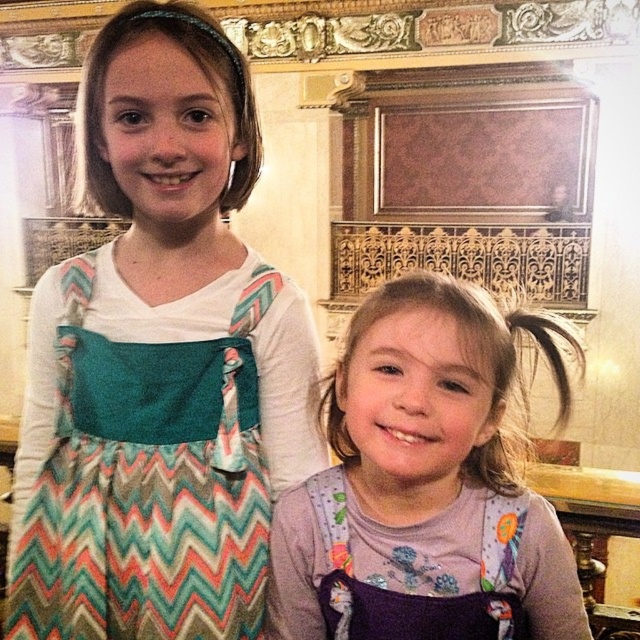
Question: Among these objects, which one is farthest from the camera?

Choices:
 (A) purple fabric overalls at center
 (B) chevron-patterned fabric apron at left

Answer: (B)

Question: Can you confirm if purple fabric overalls at center is bigger than chevron-patterned fabric apron at left?

Choices:
 (A) no
 (B) yes

Answer: (B)

Question: Which point is closer to the camera?

Choices:
 (A) chevron-patterned fabric apron at left
 (B) purple fabric overalls at center

Answer: (B)

Question: Is purple fabric overalls at center bigger than chevron-patterned fabric apron at left?

Choices:
 (A) yes
 (B) no

Answer: (A)

Question: In this image, where is purple fabric overalls at center located relative to chevron-patterned fabric apron at left?

Choices:
 (A) left
 (B) right

Answer: (B)

Question: Which object is farther from the camera taking this photo?

Choices:
 (A) chevron-patterned fabric apron at left
 (B) purple fabric overalls at center

Answer: (A)